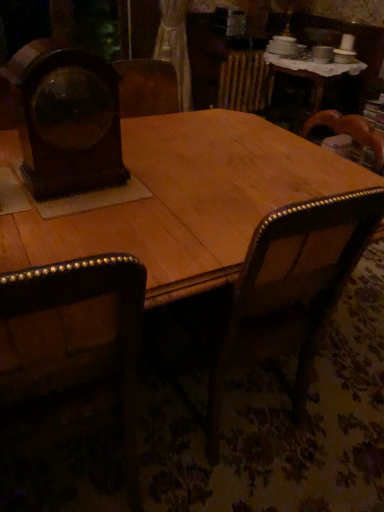
Locate an element on the screen. The height and width of the screenshot is (512, 384). empty space that is to the right of wooden clock at left is located at coordinates (149, 186).